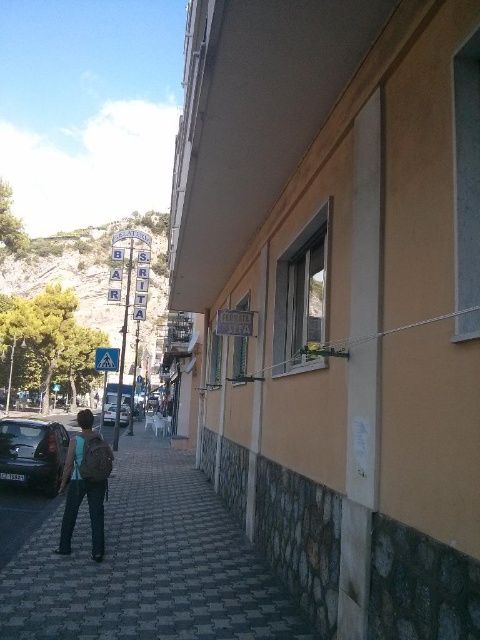
Question: Which object is farther from the camera taking this photo?

Choices:
 (A) brown backpack at center
 (B) silver metallic van at center

Answer: (B)

Question: Is brown backpack at center above shiny black car at lower left?

Choices:
 (A) no
 (B) yes

Answer: (B)

Question: Is dark gray paving stone at lower left positioned before shiny black car at lower left?

Choices:
 (A) yes
 (B) no

Answer: (A)

Question: Among these objects, which one is farthest from the camera?

Choices:
 (A) dark gray paving stone at lower left
 (B) shiny black car at lower left

Answer: (B)

Question: Can you confirm if dark gray paving stone at lower left is thinner than shiny black car at lower left?

Choices:
 (A) yes
 (B) no

Answer: (B)

Question: Which object is positioned farthest from the dark gray paving stone at lower left?

Choices:
 (A) brown backpack at center
 (B) silver metallic van at center
 (C) shiny black car at lower left

Answer: (B)